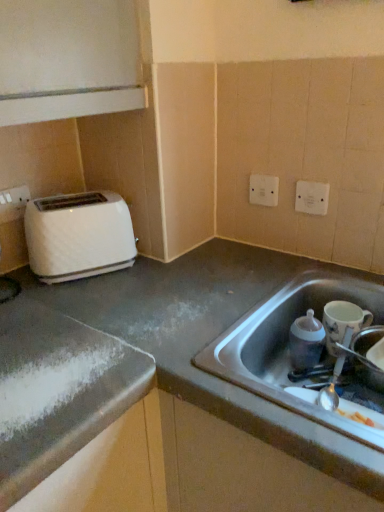
Question: From a real-world perspective, is white plastic electric outlet at upper right, the 2th electric outlet positioned from the back, physically located above or below matte plastic baby bottle at sink, the first appliance in the left-to-right sequence?

Choices:
 (A) below
 (B) above

Answer: (B)

Question: Would you say white plastic electric outlet at upper right, the first electric outlet from the right, is to the left or to the right of matte plastic baby bottle at sink, the first appliance in the left-to-right sequence, in the picture?

Choices:
 (A) left
 (B) right

Answer: (B)

Question: Estimate the real-world distances between objects in this image. Which object is closer to the white plastic electric outlet at upper right, acting as the second electric outlet starting from the left?

Choices:
 (A) white glossy mug at right, which ranks as the second appliance in right-to-left order
 (B) white glossy cup at lower right, which ranks as the third appliance in left-to-right order
 (C) smooth gray countertop at lower right
 (D) white plastic toaster at left
 (E) white plastic electric outlet at upper center, which is counted as the 1th electric outlet, starting from the left

Answer: (E)

Question: Which object is the closest to the white glossy cup at lower right, which ranks as the third appliance in left-to-right order?

Choices:
 (A) matte plastic baby bottle at sink, arranged as the third appliance when viewed from the right
 (B) white glossy mug at right, placed as the 2th appliance when sorted from left to right
 (C) stainless steel sink at lower right
 (D) smooth gray countertop at lower right
 (E) white plastic electric outlet at upper center, the 2th electric outlet viewed from the right

Answer: (B)